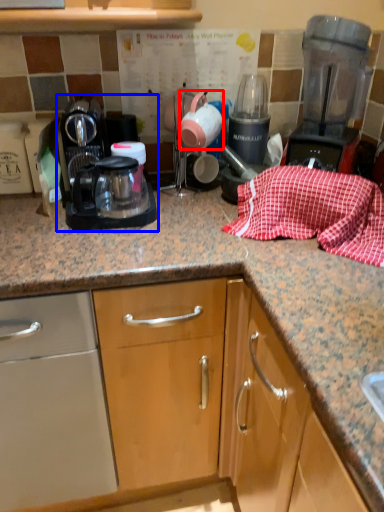
Question: Which object is closer to the camera taking this photo, tea pot (highlighted by a red box) or kitchen appliance (highlighted by a blue box)?

Choices:
 (A) tea pot
 (B) kitchen appliance

Answer: (B)